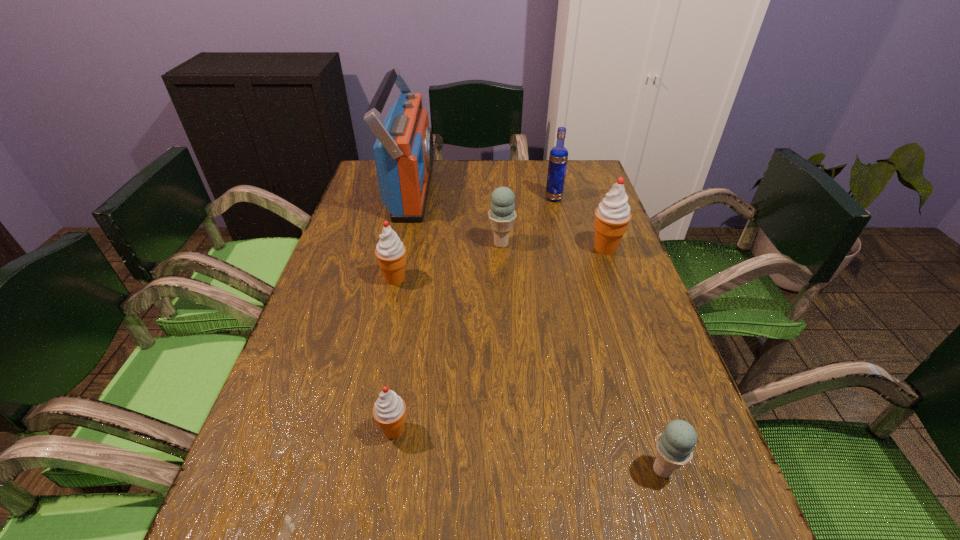
Locate an element on the screen. radio receiver is located at coordinates pyautogui.click(x=404, y=150).

Identify the location of blue radio receiver. (404, 150).

The image size is (960, 540). I want to click on blue vodka, so click(558, 157).

Find the location of a particular element. vodka is located at coordinates (558, 157).

What are the coordinates of `the rightmost red icecream` in the screenshot? It's located at (612, 215).

Locate an element on the screen. The height and width of the screenshot is (540, 960). the biggest red icecream is located at coordinates (612, 215).

The height and width of the screenshot is (540, 960). I want to click on the second nearest red icecream, so click(391, 253).

I want to click on the third nearest ice cream, so click(391, 253).

This screenshot has width=960, height=540. Find the location of `the left blue ice cream`. the left blue ice cream is located at coordinates (502, 215).

Where is `the farther blue ice cream`? Image resolution: width=960 pixels, height=540 pixels. the farther blue ice cream is located at coordinates (502, 215).